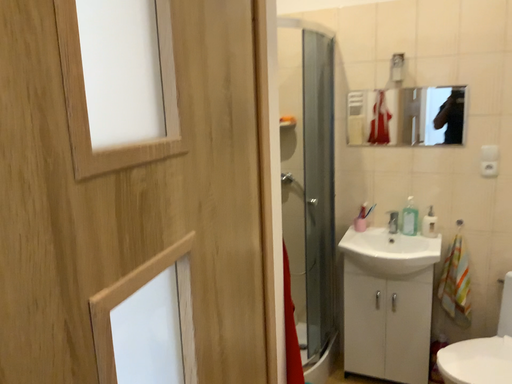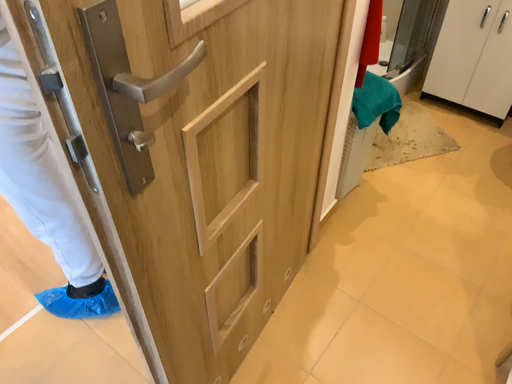
Question: How did the camera likely rotate when shooting the video?

Choices:
 (A) rotated upward
 (B) rotated downward

Answer: (B)